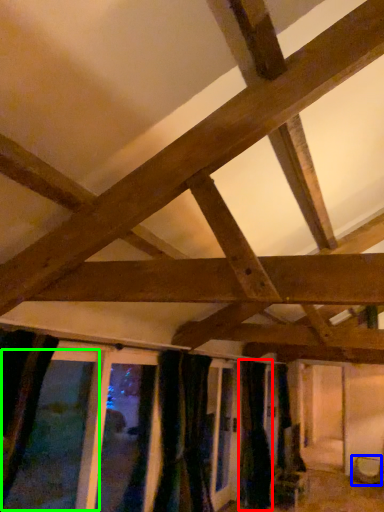
Question: Based on their relative distances, which object is nearer to curtain (highlighted by a red box)? Choose from furniture (highlighted by a blue box) and window (highlighted by a green box).

Choices:
 (A) furniture
 (B) window

Answer: (A)